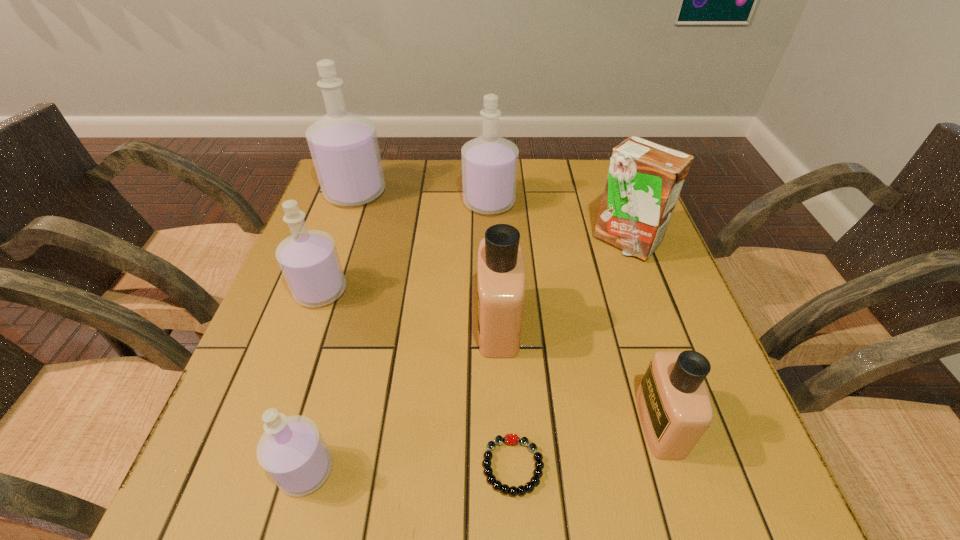
The image size is (960, 540). Find the location of `the tallest object`. the tallest object is located at coordinates (344, 147).

The height and width of the screenshot is (540, 960). Identify the location of the tallest perfume. (x=344, y=147).

You are a GUI agent. You are given a task and a screenshot of the screen. Output one action in this format:
    pyautogui.click(x=<x>, y=<y>)
    Task: Click on the third smallest purple perfume
    The image size is (960, 540).
    Given the screenshot: What is the action you would take?
    pyautogui.click(x=489, y=163)

Where is `the fifth shortest perfume`? The image size is (960, 540). the fifth shortest perfume is located at coordinates (489, 163).

The image size is (960, 540). What are the coordinates of `the third farthest object` in the screenshot? It's located at (644, 180).

Where is `the second smallest purple perfume`? Image resolution: width=960 pixels, height=540 pixels. the second smallest purple perfume is located at coordinates (309, 261).

I want to click on the left beige perfume, so click(x=501, y=282).

You are a GUI agent. You are given a task and a screenshot of the screen. Output one action in this format:
    pyautogui.click(x=<x>, y=<y>)
    Task: Click on the bigger beige perfume
    The image size is (960, 540).
    Given the screenshot: What is the action you would take?
    pyautogui.click(x=501, y=282)

Where is `the smaller beige perfume`? The image size is (960, 540). the smaller beige perfume is located at coordinates (675, 409).

At what (x,y) coordinates should I click in order to perform the action: click on the nearer beige perfume. Please return your answer as a coordinate pair (x, y). The height and width of the screenshot is (540, 960). Looking at the image, I should click on (675, 409).